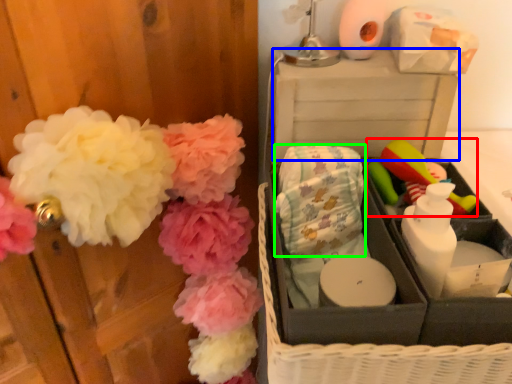
Question: Based on their relative distances, which object is nearer to toy (highlighted by a red box)? Choose from storage box (highlighted by a blue box) and material (highlighted by a green box).

Choices:
 (A) storage box
 (B) material

Answer: (A)